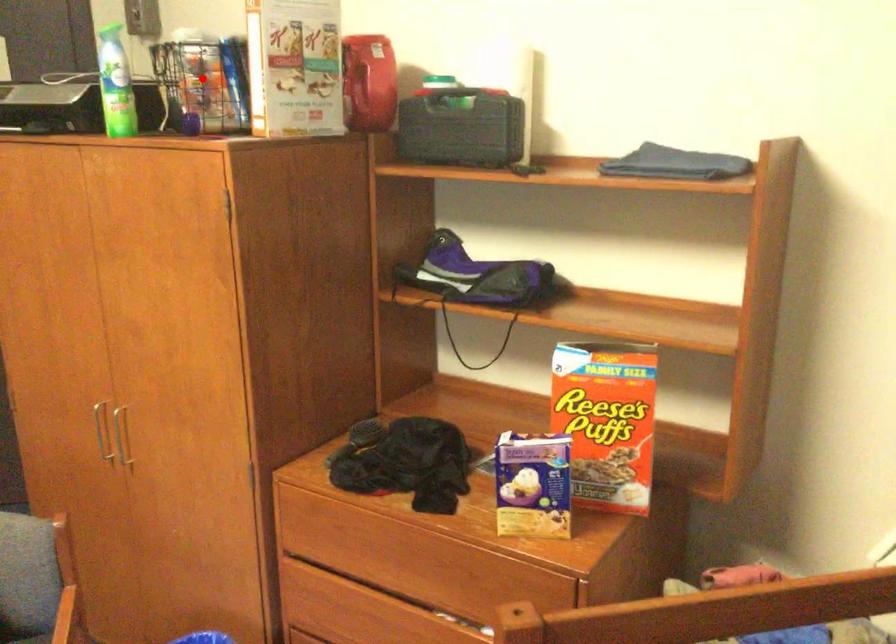
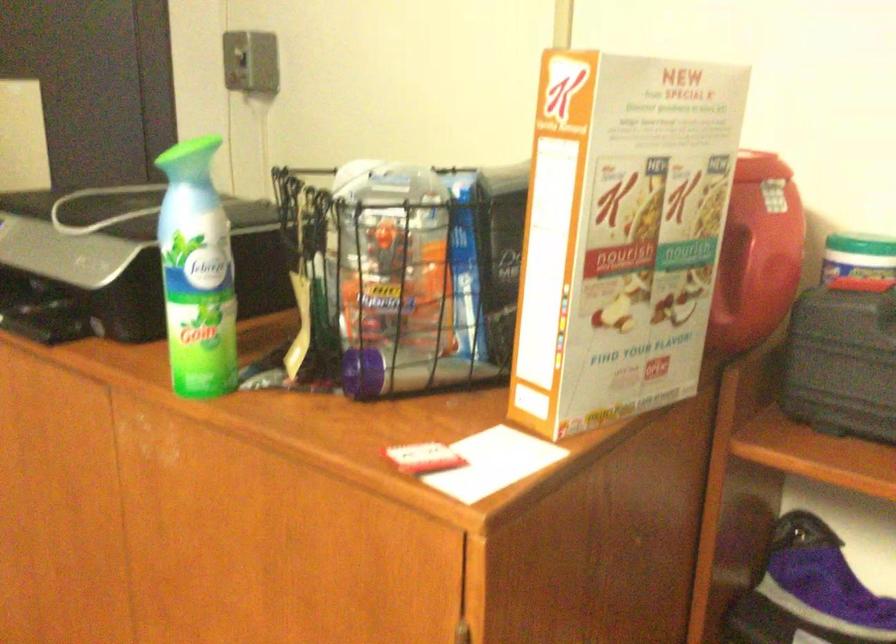
Question: I am providing you with two images of the same scene from different viewpoints. In image1, a red point is highlighted. Considering the same 3D point in image2, which of the following is correct?

Choices:
 (A) It is closer
 (B) It is farther

Answer: (A)